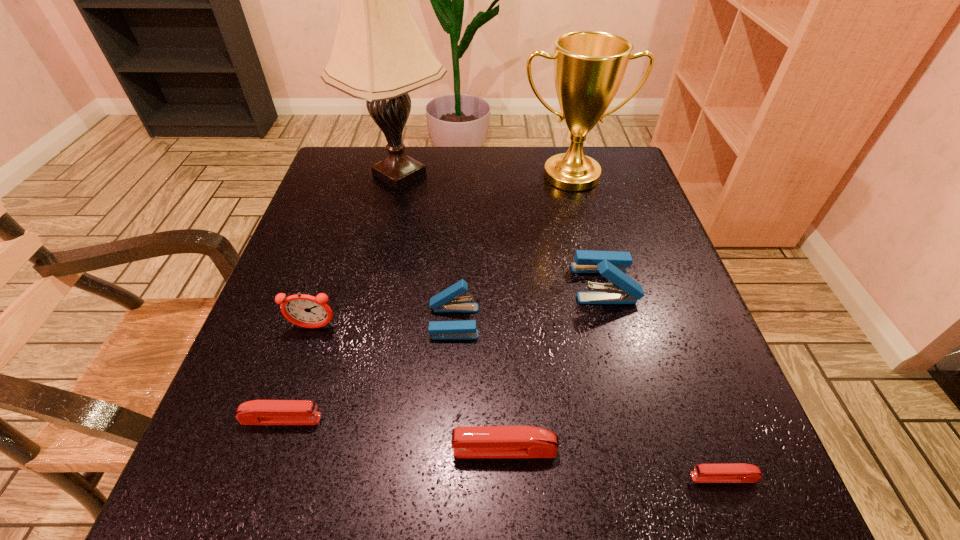
The height and width of the screenshot is (540, 960). Find the location of `the third tallest stapler`. the third tallest stapler is located at coordinates [x=468, y=441].

Identify the location of the leftmost red stapler. (256, 412).

Where is `the third nearest stapler`? The width and height of the screenshot is (960, 540). the third nearest stapler is located at coordinates (256, 412).

Find the location of a particular element. The height and width of the screenshot is (540, 960). the rightmost red stapler is located at coordinates (735, 472).

Find the location of a particular element. The width and height of the screenshot is (960, 540). the smallest red stapler is located at coordinates (735, 472).

You are a GUI agent. You are given a task and a screenshot of the screen. Output one action in this format:
    pyautogui.click(x=<x>, y=<y>)
    Task: Click on the free location located 0.360m on the front of the lamp
    
    Given the screenshot: What is the action you would take?
    pyautogui.click(x=365, y=327)

Find the location of a particular element. The width and height of the screenshot is (960, 540). free region located by the handles of the award is located at coordinates (594, 266).

This screenshot has height=540, width=960. Identify the location of free spot located on the back of the farther blue stapler. (589, 227).

Identify the location of blank area located 0.050m on the front-facing side of the alarm clock. (304, 356).

Locate an element on the screen. This screenshot has width=960, height=540. vacant space located 0.250m on the back of the smaller blue stapler is located at coordinates (459, 221).